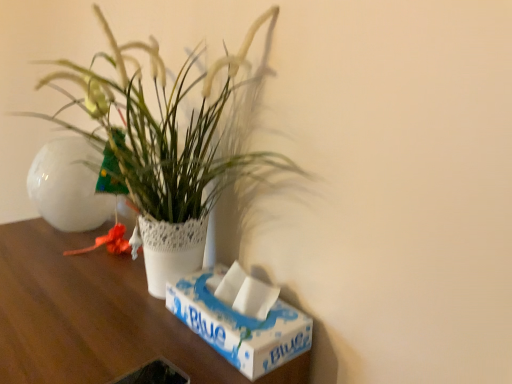
The image size is (512, 384). I want to click on free space that is in between white glossy flowerpot at left and white lace pot at center, so [121, 298].